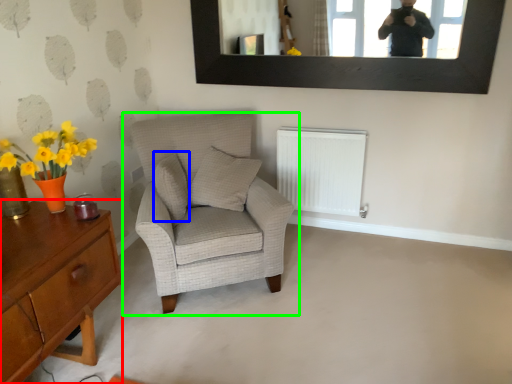
Question: Based on their relative distances, which object is nearer to desk (highlighted by a red box)? Choose from pillow (highlighted by a blue box) and chair (highlighted by a green box).

Choices:
 (A) pillow
 (B) chair

Answer: (B)